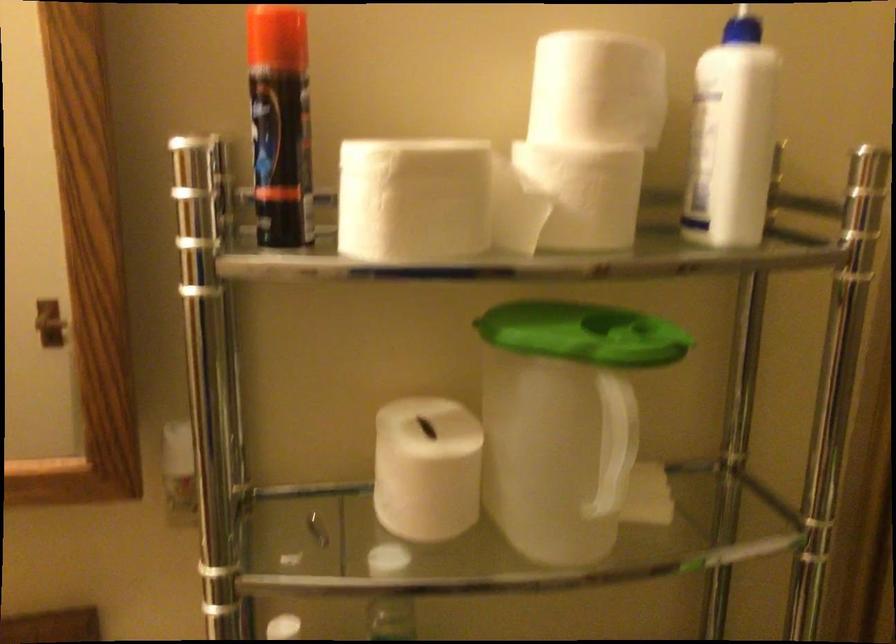
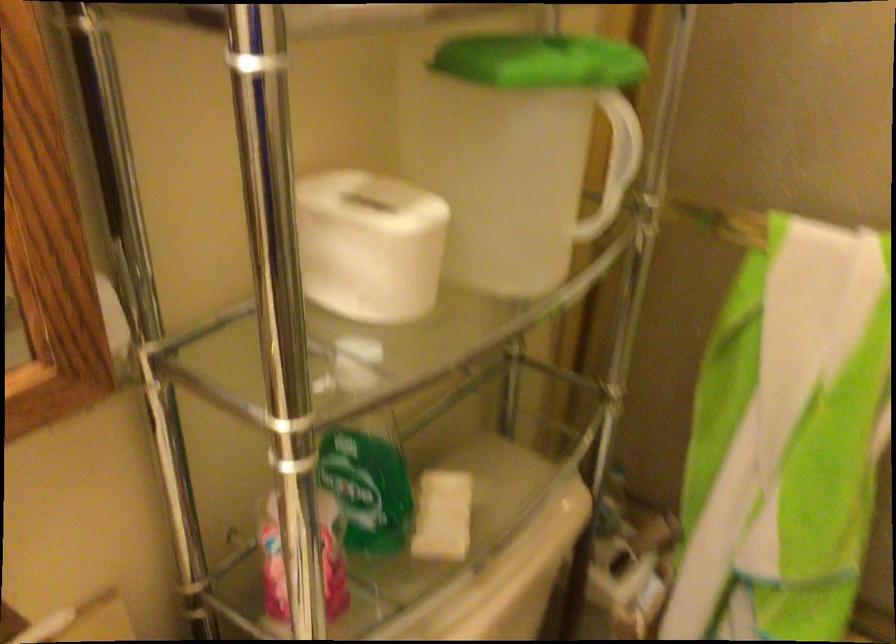
Find the pixel in the second image that matches (624,431) in the first image.

(618, 152)